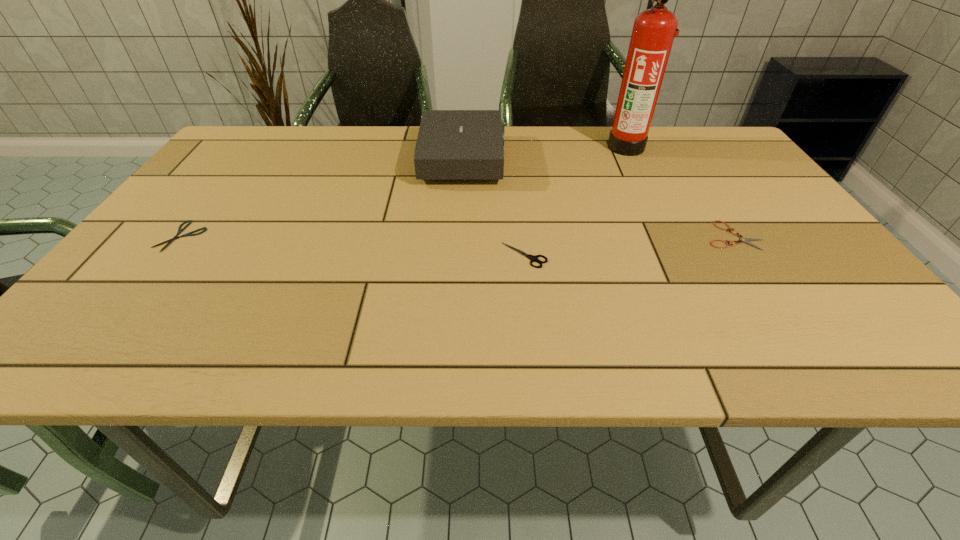
Identify the location of vacant region at the right edge of the desktop. tap(828, 273).

In the image, there is a desktop. In order to click on vacant space at the far left corner in this screenshot , I will do `click(247, 156)`.

Identify the location of vacant area at the far right corner of the desktop. The image size is (960, 540). (732, 151).

In the image, there is a desktop. Where is `vacant space at the near right corner`? This screenshot has height=540, width=960. vacant space at the near right corner is located at coordinates (883, 352).

Find the location of a particular element. free spot between the fire extinguisher and the rightmost shears is located at coordinates (680, 191).

What are the coordinates of `vacant space that is in between the fire extinguisher and the leftmost object` in the screenshot? It's located at (404, 191).

Where is `vacant area between the tallest object and the second shears from left to right`? This screenshot has width=960, height=540. vacant area between the tallest object and the second shears from left to right is located at coordinates (575, 201).

Identify the location of vacant space in between the tallest object and the third tallest object. (575, 201).

What are the coordinates of `free point between the projector and the second object from right to left` in the screenshot? It's located at (544, 153).

Image resolution: width=960 pixels, height=540 pixels. Identify the location of free space between the second shears from left to right and the second object from right to left. (575, 201).